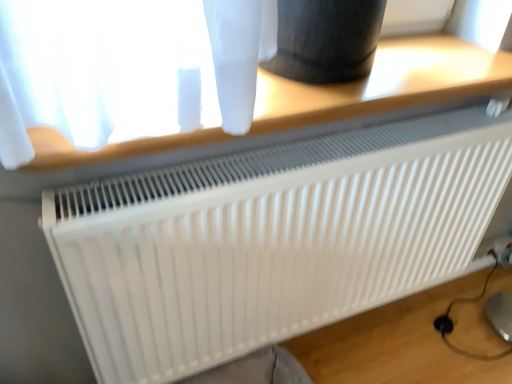
What is the approximate height of white plastic table at upper center?

It is 5.44 centimeters.

Measure the distance between point (255,117) and camera.

Point (255,117) is 76.70 centimeters from camera.

The width and height of the screenshot is (512, 384). What do you see at coordinates (386, 83) in the screenshot?
I see `white plastic table at upper center` at bounding box center [386, 83].

This screenshot has height=384, width=512. Identify the location of white plastic table at upper center. (386, 83).

Where is `white matte radiator at center`? The image size is (512, 384). white matte radiator at center is located at coordinates (271, 239).

Describe the element at coordinates (271, 239) in the screenshot. This screenshot has width=512, height=384. I see `white matte radiator at center` at that location.

Locate an element on the screen. This screenshot has height=384, width=512. white plastic table at upper center is located at coordinates (386, 83).

Does white matte radiator at center appear on the right side of white plastic table at upper center?

Yes.

Considering the relative positions of white matte radiator at center and white plastic table at upper center in the image provided, is white matte radiator at center in front of white plastic table at upper center?

No, white matte radiator at center is behind white plastic table at upper center.

Is point (420, 178) positioned after point (66, 151)?

That is True.

From the image's perspective, between white matte radiator at center and white plastic table at upper center, which one is located above?

white plastic table at upper center appears higher in the image.

From a real-world perspective, who is located lower, white matte radiator at center or white plastic table at upper center?

white matte radiator at center.

In terms of width, does white matte radiator at center look wider or thinner when compared to white plastic table at upper center?

Clearly, white matte radiator at center has less width compared to white plastic table at upper center.

From the picture: Can you confirm if white matte radiator at center is shorter than white plastic table at upper center?

In fact, white matte radiator at center may be taller than white plastic table at upper center.

Looking at the image, does white matte radiator at center seem bigger or smaller compared to white plastic table at upper center?

Clearly, white matte radiator at center is larger in size than white plastic table at upper center.

Choose the correct answer: Is white matte radiator at center inside white plastic table at upper center or outside it?

white matte radiator at center exists outside the volume of white plastic table at upper center.

Is white matte radiator at center not close to white plastic table at upper center?

white matte radiator at center is actually quite close to white plastic table at upper center.

Is white matte radiator at center oriented away from white plastic table at upper center?

No, white matte radiator at center's orientation is not away from white plastic table at upper center.

How many degrees apart are the facing directions of white matte radiator at center and white plastic table at upper center?

white matte radiator at center and white plastic table at upper center are facing 0.236 degrees away from each other.

Identify the location of radiator on the right of white plastic table at upper center. (271, 239).

Is white plastic table at upper center at the right side of white matte radiator at center?

In fact, white plastic table at upper center is to the left of white matte radiator at center.

Between white plastic table at upper center and white matte radiator at center, which one is positioned in front?

white plastic table at upper center is in front.

Considering the points (298, 103) and (425, 175), which point is behind, point (298, 103) or point (425, 175)?

The point (425, 175) is behind.

Looking at this image, from the image's perspective, is white plastic table at upper center located above or below white matte radiator at center?

From the image's perspective, white plastic table at upper center appears above white matte radiator at center.

From a real-world perspective, is white plastic table at upper center located higher than white matte radiator at center?

Yes.

Which of these two, white plastic table at upper center or white matte radiator at center, is wider?

With larger width is white plastic table at upper center.

Between white plastic table at upper center and white matte radiator at center, which one has more height?

With more height is white matte radiator at center.

Can you confirm if white plastic table at upper center is bigger than white matte radiator at center?

Actually, white plastic table at upper center might be smaller than white matte radiator at center.

Could white matte radiator at center be considered to be inside white plastic table at upper center?

No, white matte radiator at center is not surrounded by white plastic table at upper center.

Does white plastic table at upper center touch white matte radiator at center?

No, white plastic table at upper center is not in contact with white matte radiator at center.

Is white plastic table at upper center oriented away from white matte radiator at center?

white plastic table at upper center is not turned away from white matte radiator at center.

Locate an element on the screen. table that appears above the white matte radiator at center (from the image's perspective) is located at coordinates (386, 83).

You are a GUI agent. You are given a task and a screenshot of the screen. Output one action in this format:
    pyautogui.click(x=<x>, y=<y>)
    Task: Click on the table that appears on the left of white matte radiator at center
    Image resolution: width=512 pixels, height=384 pixels.
    Given the screenshot: What is the action you would take?
    pyautogui.click(x=386, y=83)

Locate an element on the screen. The width and height of the screenshot is (512, 384). table above the white matte radiator at center (from a real-world perspective) is located at coordinates (386, 83).